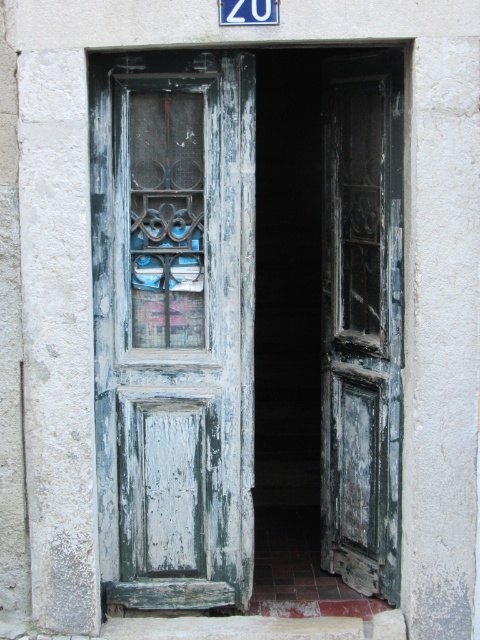
Question: Which point is farther to the camera?

Choices:
 (A) (265, 1)
 (B) (343, 225)
 (C) (180, 314)

Answer: (B)

Question: Does weathered teal wood door at center appear on the left side of distressed green wood door at center?

Choices:
 (A) no
 (B) yes

Answer: (B)

Question: Observing the image, what is the correct spatial positioning of weathered teal wood door at center in reference to distressed green wood door at center?

Choices:
 (A) left
 (B) right

Answer: (A)

Question: Which point is farther to the camera?

Choices:
 (A) (162, 464)
 (B) (222, 4)
 (C) (373, 500)

Answer: (C)

Question: Which of the following is the closest to the observer?

Choices:
 (A) (395, 378)
 (B) (219, 301)
 (C) (245, 17)

Answer: (C)

Question: Does weathered teal wood door at center come in front of distressed green wood door at center?

Choices:
 (A) no
 (B) yes

Answer: (A)